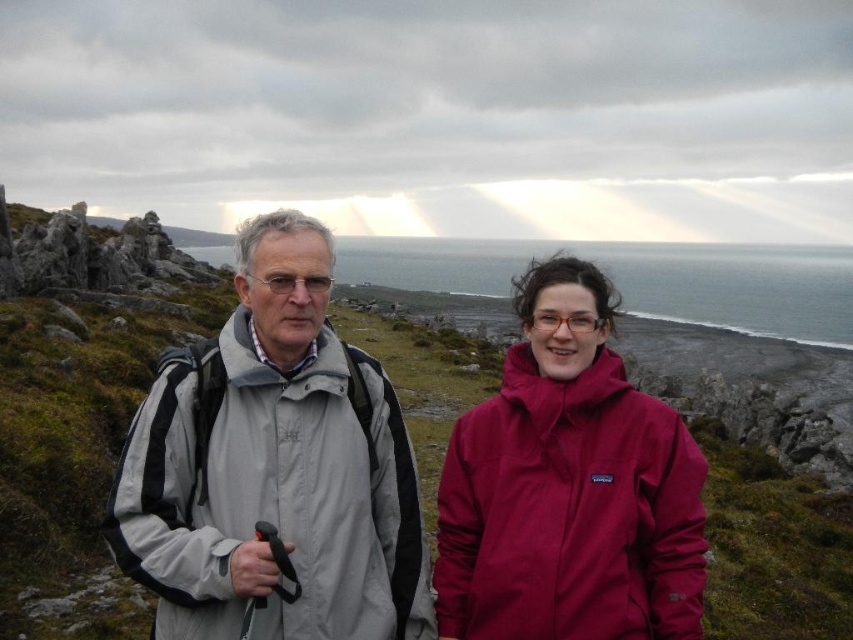
Question: Which object appears farthest from the camera in this image?

Choices:
 (A) gray fabric jacket at center
 (B) burgundy waterproof jacket at center

Answer: (B)

Question: Which object is closer to the camera taking this photo?

Choices:
 (A) gray water at center
 (B) burgundy waterproof jacket at center

Answer: (B)

Question: Does gray fabric jacket at center appear on the left side of burgundy waterproof jacket at center?

Choices:
 (A) yes
 (B) no

Answer: (A)

Question: Is gray fabric jacket at center bigger than gray water at center?

Choices:
 (A) no
 (B) yes

Answer: (A)

Question: Which point is farther to the camera?

Choices:
 (A) (466, 288)
 (B) (297, 298)

Answer: (A)

Question: Does gray fabric jacket at center have a lesser width compared to gray water at center?

Choices:
 (A) no
 (B) yes

Answer: (B)